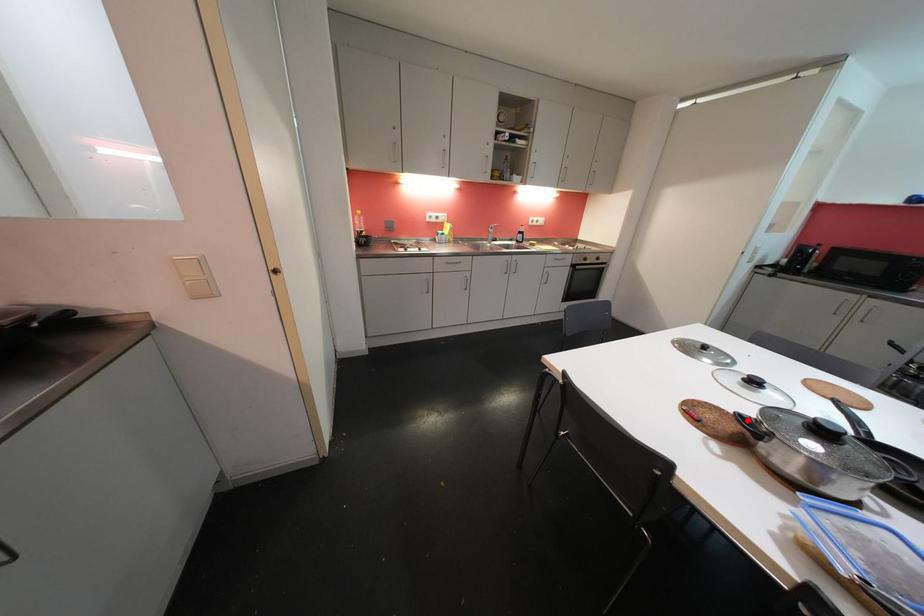
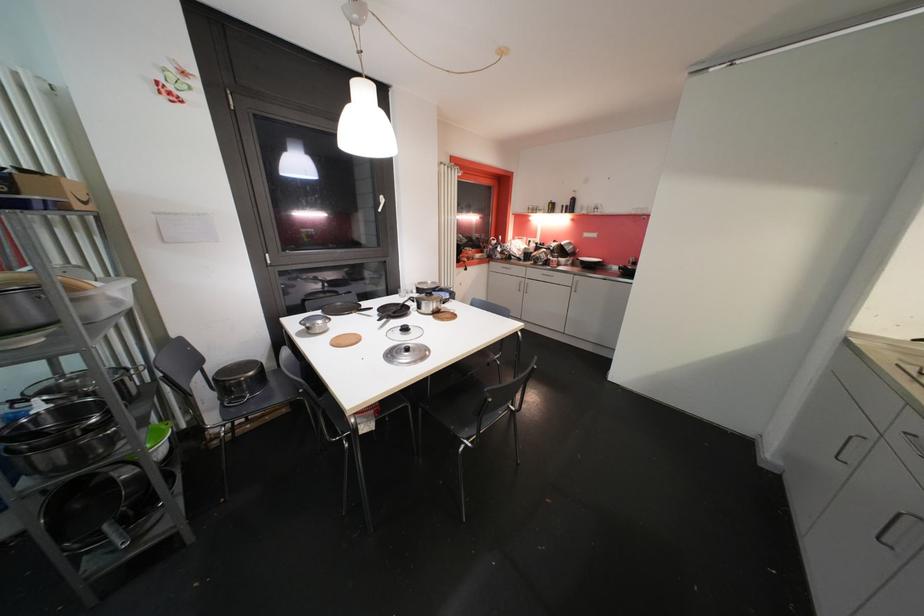
The point at the highlighted location is marked in the first image. Where is the corresponding point in the second image?

(450, 305)